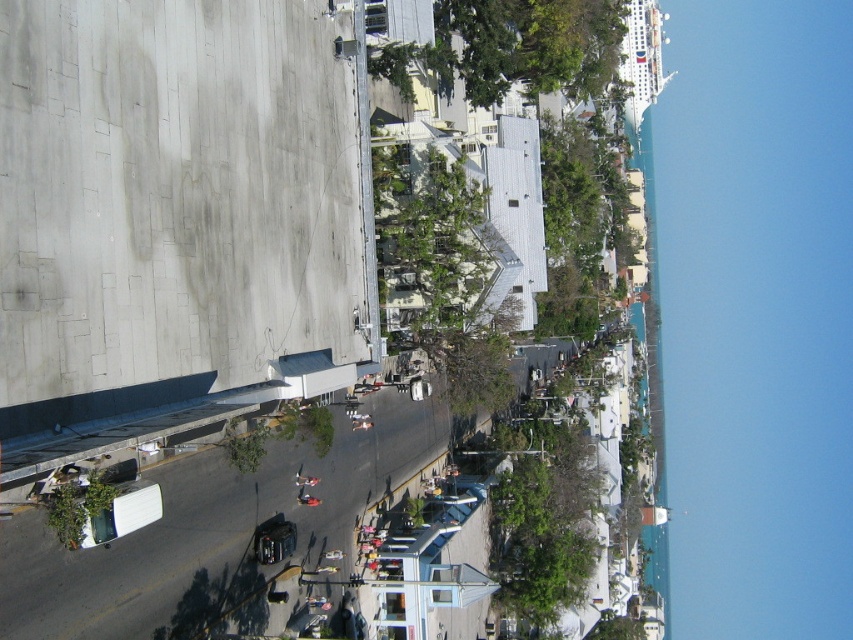
Question: Does green leafy tree at upper center lie behind green leafy tree at center?

Choices:
 (A) no
 (B) yes

Answer: (A)

Question: Can you confirm if green leafy tree at upper center is positioned to the right of green leafy tree at center?

Choices:
 (A) no
 (B) yes

Answer: (B)

Question: Which point is closer to the camera?

Choices:
 (A) (479, 8)
 (B) (445, 300)

Answer: (B)

Question: Which point is closer to the camera taking this photo?

Choices:
 (A) (485, 13)
 (B) (401, 292)

Answer: (B)

Question: Where is green leafy tree at upper center located in relation to green leafy tree at center in the image?

Choices:
 (A) right
 (B) left

Answer: (A)

Question: Which of the following is the farthest from the observer?

Choices:
 (A) green leafy tree at center
 (B) green leafy tree at upper center

Answer: (A)